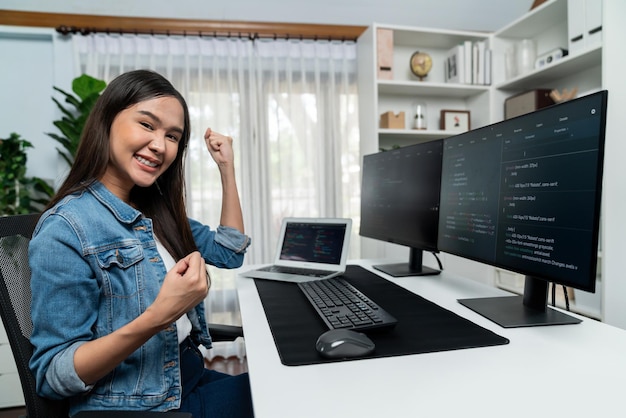
At what (x,y) coordinates should I click in order to perform the action: click on curtains. Please return your answer as a coordinate pair (x, y). The image size is (626, 418). Looking at the image, I should click on (223, 57), (300, 84).